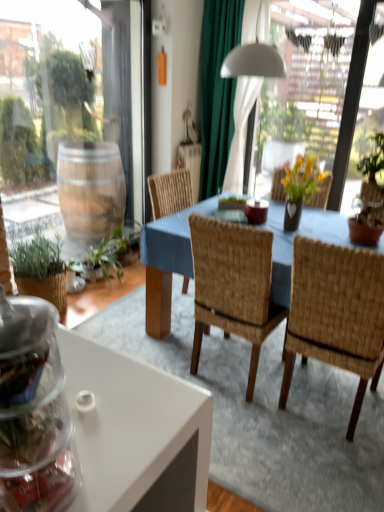
Question: Which direction should I rotate to look at woven wood chair at center, which is counted as the 2th chair, starting from the right?

Choices:
 (A) left
 (B) right

Answer: (B)

Question: Is transparent plastic jar at lower left oriented away from woven wood chair at center, which is counted as the 2th chair, starting from the right?

Choices:
 (A) yes
 (B) no

Answer: (B)

Question: From a real-world perspective, is transparent plastic jar at lower left positioned under woven wood chair at center, which is counted as the 2th chair, starting from the right, based on gravity?

Choices:
 (A) no
 (B) yes

Answer: (A)

Question: Does transparent plastic jar at lower left have a lesser height compared to woven wood chair at center, which is the 1th chair from left to right?

Choices:
 (A) no
 (B) yes

Answer: (B)

Question: Is transparent plastic jar at lower left positioned in front of woven wood chair at center, which is counted as the 2th chair, starting from the right?

Choices:
 (A) no
 (B) yes

Answer: (B)

Question: Is woven wood chair at center, which is counted as the 2th chair, starting from the right, completely or partially inside transparent plastic jar at lower left?

Choices:
 (A) yes
 (B) no

Answer: (B)

Question: Considering the relative sizes of transparent plastic jar at lower left and woven wood chair at center, which is counted as the 2th chair, starting from the right, in the image provided, is transparent plastic jar at lower left bigger than woven wood chair at center, which is counted as the 2th chair, starting from the right,?

Choices:
 (A) no
 (B) yes

Answer: (A)

Question: Is green fabric curtain at upper center behind woven wood chair at center, the 1th chair positioned from the right?

Choices:
 (A) yes
 (B) no

Answer: (A)

Question: Is woven wood chair at center, which is the second chair from left to right, surrounded by green fabric curtain at upper center?

Choices:
 (A) yes
 (B) no

Answer: (B)

Question: Considering the relative sizes of green fabric curtain at upper center and woven wood chair at center, the 1th chair positioned from the right, in the image provided, is green fabric curtain at upper center shorter than woven wood chair at center, the 1th chair positioned from the right,?

Choices:
 (A) no
 (B) yes

Answer: (A)

Question: From a real-world perspective, is green fabric curtain at upper center located higher than woven wood chair at center, which is the second chair from left to right?

Choices:
 (A) yes
 (B) no

Answer: (A)

Question: From a real-world perspective, is green fabric curtain at upper center located beneath woven wood chair at center, the 1th chair positioned from the right?

Choices:
 (A) no
 (B) yes

Answer: (A)

Question: Is green fabric curtain at upper center taller than woven wood chair at center, which is the second chair from left to right?

Choices:
 (A) no
 (B) yes

Answer: (B)

Question: From a real-world perspective, is woven wood chair at center, which is the second chair from left to right, physically below green fabric curtain at upper center?

Choices:
 (A) yes
 (B) no

Answer: (A)